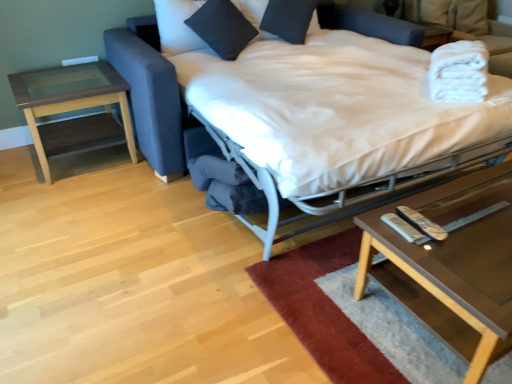
At what (x,y) coordinates should I click in order to perform the action: click on free space between brown wood/glass side table at left and white fabric bed at center. Please return your answer as a coordinate pair (x, y). The height and width of the screenshot is (384, 512). Looking at the image, I should click on (125, 218).